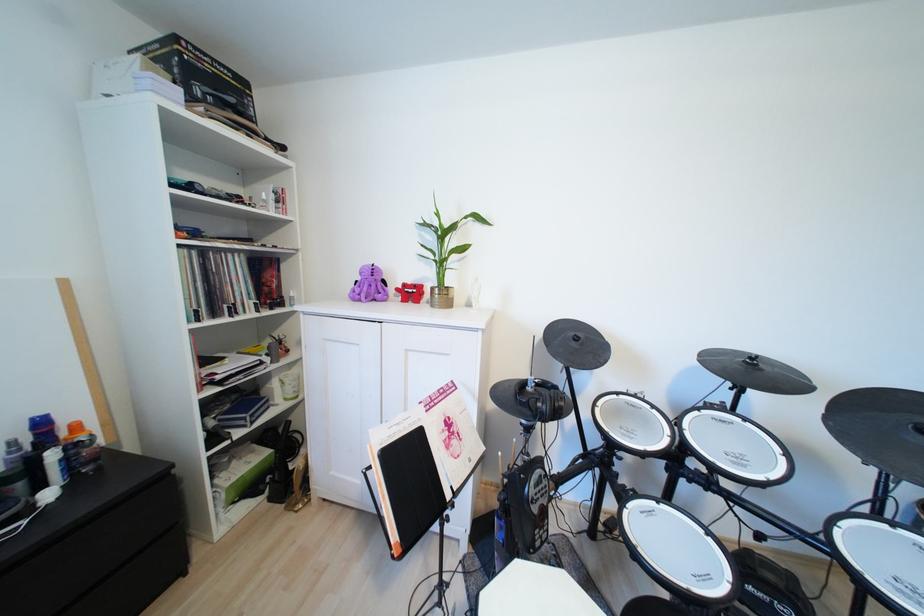
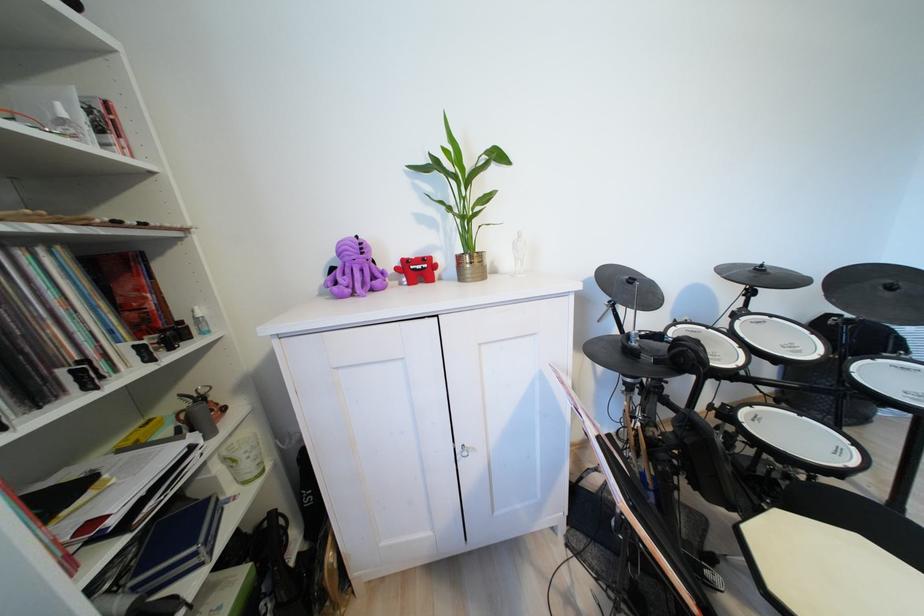
In a continuous first-person perspective shot, in which direction is the camera moving?

The cameraman moved toward left, forward.